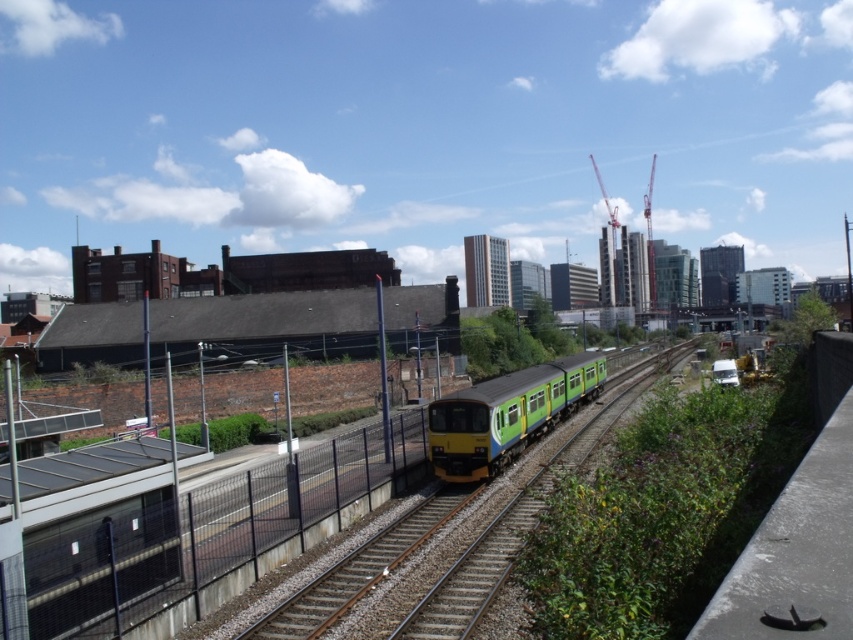
Question: Which object appears closest to the camera in this image?

Choices:
 (A) green matte train at center
 (B) brown gravel train track at center

Answer: (B)

Question: Is the position of green matte train at center less distant than that of brown gravel train track at center?

Choices:
 (A) no
 (B) yes

Answer: (A)

Question: Which object appears farthest from the camera in this image?

Choices:
 (A) green matte train at center
 (B) brown gravel train track at center

Answer: (A)

Question: Which point is closer to the camera?

Choices:
 (A) green matte train at center
 (B) brown gravel train track at center

Answer: (B)

Question: Can you confirm if green matte train at center is wider than brown gravel train track at center?

Choices:
 (A) no
 (B) yes

Answer: (B)

Question: Does green matte train at center have a smaller size compared to brown gravel train track at center?

Choices:
 (A) yes
 (B) no

Answer: (B)